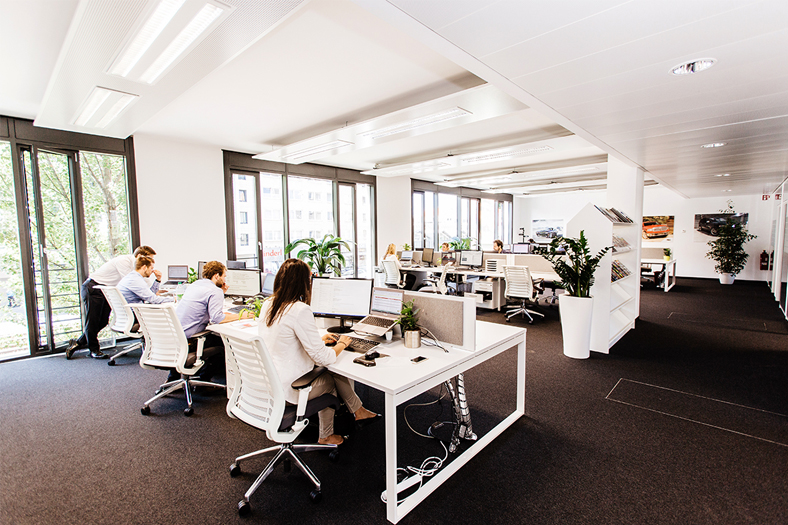
The width and height of the screenshot is (788, 525). Identify the location of chair swivel bases. (273, 454), (188, 393), (129, 346), (529, 309).